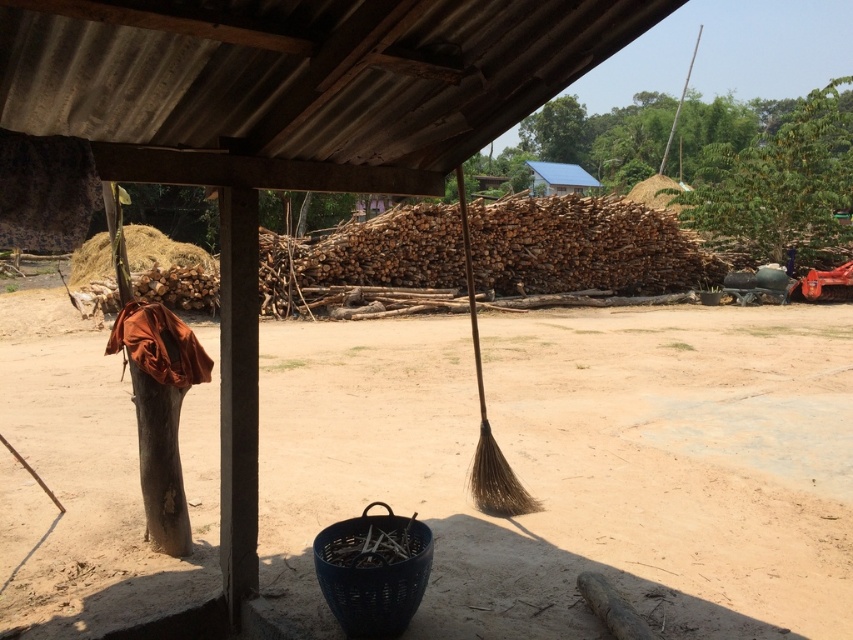
You are a gardener who needs to store a new tool. You have a choice between placing it on the brown dirt field at center or the brown natural fiber broom at center. Which location would provide more space for the tool?

The brown dirt field at center is bigger than the brown natural fiber broom at center, so placing the tool on the brown dirt field at center would provide more space.

You are standing at the entrance of the shelter and want to walk to the brown dirt field at center. Which direction should you move relative to your current position?

The brown dirt field at center is located at coordinates approximately 0.727 on the x axis and 0.678 on the y axis. Since you are at the entrance, moving towards the center of the image would mean heading towards the direction where both x and y increase from your position.